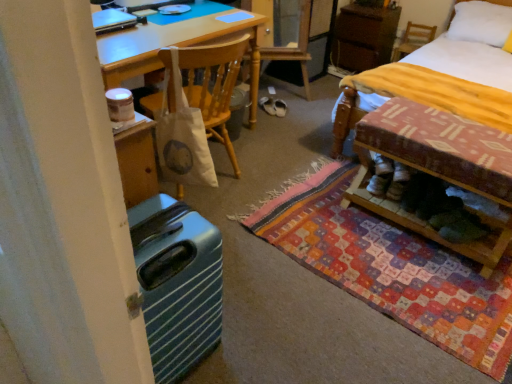
What do you see at coordinates (268, 105) in the screenshot? This screenshot has height=384, width=512. I see `white fabric shoe at center, marked as the first footwear in a left-to-right arrangement` at bounding box center [268, 105].

Where is `white soft pillow at upper right`? The width and height of the screenshot is (512, 384). white soft pillow at upper right is located at coordinates [481, 23].

Image resolution: width=512 pixels, height=384 pixels. Find the location of `multicolored woven mat at lower right`. multicolored woven mat at lower right is located at coordinates (390, 267).

Identify the location of yellow fabric bed at lower right. (345, 119).

Find the location of a particular element. wooden chair at upper right, positioned as the 2th chair in bottom-to-top order is located at coordinates (413, 39).

Which object is closer to the camera, wooden chair at upper right, the 2th chair from the left, or white canvas bag at center, acting as the 1th chair starting from the front?

white canvas bag at center, acting as the 1th chair starting from the front, is in front.

Is wooden chair at upper right, placed as the first chair when sorted from back to front, oriented away from white canvas bag at center, the 2th chair positioned from the back?

wooden chair at upper right, placed as the first chair when sorted from back to front, is not turned away from white canvas bag at center, the 2th chair positioned from the back.

From the image's perspective, is wooden chair at upper right, positioned as the 2th chair in bottom-to-top order, located beneath white canvas bag at center, acting as the 1th chair starting from the front?

No, from the image's perspective, wooden chair at upper right, positioned as the 2th chair in bottom-to-top order, is not below white canvas bag at center, acting as the 1th chair starting from the front.

Based on the photo, from the image's perspective, which is above, brown wood cabinet at upper right or white canvas bag at center, the second chair in the top-to-bottom sequence?

brown wood cabinet at upper right, from the image's perspective.

Can you confirm if brown wood cabinet at upper right is positioned to the left of white canvas bag at center, the 1th chair when ordered from bottom to top?

No, brown wood cabinet at upper right is not to the left of white canvas bag at center, the 1th chair when ordered from bottom to top.

Is brown wood cabinet at upper right smaller than white canvas bag at center, acting as the 1th chair starting from the front?

No.

Are white fabric shoe at center, the 2th footwear viewed from the left, and wooden chair at upper right, the 2th chair from the left, making contact?

They are not placed beside each other.

How many degrees apart are the facing directions of white fabric shoe at center, the first footwear viewed from the right, and wooden chair at upper right, placed as the first chair when sorted from back to front?

There is a 32.6-degree angle between the facing directions of white fabric shoe at center, the first footwear viewed from the right, and wooden chair at upper right, placed as the first chair when sorted from back to front.

Looking at this image, from a real-world perspective, is white fabric shoe at center, the first footwear viewed from the right, physically below wooden chair at upper right, placed as the first chair when sorted from back to front?

Yes, from a real-world perspective, white fabric shoe at center, the first footwear viewed from the right, is under wooden chair at upper right, placed as the first chair when sorted from back to front.

Measure the distance between white fabric shoe at center, the 2th footwear viewed from the left, and wooden chair at upper right, the 2th chair from the left.

The distance of white fabric shoe at center, the 2th footwear viewed from the left, from wooden chair at upper right, the 2th chair from the left, is 5.39 feet.

Considering the relative sizes of yellow fabric bed at lower right and brown wood cabinet at upper right in the image provided, is yellow fabric bed at lower right shorter than brown wood cabinet at upper right?

No, yellow fabric bed at lower right is not shorter than brown wood cabinet at upper right.

You are a GUI agent. You are given a task and a screenshot of the screen. Output one action in this format:
    pyautogui.click(x=<x>, y=<y>)
    Task: Click on the cabinetry behind the yellow fabric bed at lower right
    The height and width of the screenshot is (384, 512).
    Given the screenshot: What is the action you would take?
    pyautogui.click(x=364, y=37)

In the scene shown: Considering the positions of objects yellow fabric bed at lower right and brown wood cabinet at upper right in the image provided, who is more to the right, yellow fabric bed at lower right or brown wood cabinet at upper right?

From the viewer's perspective, yellow fabric bed at lower right appears more on the right side.

Considering the sizes of objects yellow fabric bed at lower right and brown wood cabinet at upper right in the image provided, who is smaller, yellow fabric bed at lower right or brown wood cabinet at upper right?

With smaller size is brown wood cabinet at upper right.

Who is smaller, brown wood cabinet at upper right or white soft pillow at upper right?

brown wood cabinet at upper right.

Considering the relative positions of brown wood cabinet at upper right and white soft pillow at upper right in the image provided, is brown wood cabinet at upper right to the left of white soft pillow at upper right from the viewer's perspective?

Yes.

From the image's perspective, is brown wood cabinet at upper right on white soft pillow at upper right?

Correct, brown wood cabinet at upper right appears higher than white soft pillow at upper right in the image.

Is brown wood cabinet at upper right closer to camera compared to white soft pillow at upper right?

No.

Is white fabric shoe at center, marked as the 2th footwear in a right-to-left arrangement, positioned with its back to wooden chair at upper right, the 1th chair viewed from the right?

No, white fabric shoe at center, marked as the 2th footwear in a right-to-left arrangement,'s orientation is not away from wooden chair at upper right, the 1th chair viewed from the right.

From a real-world perspective, is white fabric shoe at center, marked as the first footwear in a left-to-right arrangement, positioned over wooden chair at upper right, the 1th chair viewed from the right, based on gravity?

No, from a real-world perspective, white fabric shoe at center, marked as the first footwear in a left-to-right arrangement, is not on top of wooden chair at upper right, the 1th chair viewed from the right.

Does white fabric shoe at center, marked as the first footwear in a left-to-right arrangement, appear on the right side of wooden chair at upper right, which appears as the first chair when viewed from the top?

Incorrect, white fabric shoe at center, marked as the first footwear in a left-to-right arrangement, is not on the right side of wooden chair at upper right, which appears as the first chair when viewed from the top.

From the image's perspective, between white fabric shoe at center, marked as the 2th footwear in a right-to-left arrangement, and wooden chair at upper right, the 1th chair viewed from the right, which one is located above?

wooden chair at upper right, the 1th chair viewed from the right, is shown above in the image.

Is wooden chair at upper right, positioned as the second chair in front-to-back order, situated inside multicolored woven mat at lower right or outside?

wooden chair at upper right, positioned as the second chair in front-to-back order, lies outside multicolored woven mat at lower right.

Between wooden chair at upper right, positioned as the 2th chair in bottom-to-top order, and multicolored woven mat at lower right, which one appears on the left side from the viewer's perspective?

From the viewer's perspective, multicolored woven mat at lower right appears more on the left side.

How many degrees apart are the facing directions of wooden chair at upper right, which appears as the first chair when viewed from the top, and multicolored woven mat at lower right?

The angle between the facing direction of wooden chair at upper right, which appears as the first chair when viewed from the top, and the facing direction of multicolored woven mat at lower right is 10.6 degrees.

Looking at this image, is wooden chair at upper right, positioned as the 2th chair in bottom-to-top order, closer to camera compared to multicolored woven mat at lower right?

No, wooden chair at upper right, positioned as the 2th chair in bottom-to-top order, is further to the viewer.

In order to click on chair behind the white canvas bag at center, the second chair in the top-to-bottom sequence in this screenshot , I will do `click(413, 39)`.

Where is `cabinetry below the white canvas bag at center, which ranks as the second chair in right-to-left order (from a real-world perspective)`? cabinetry below the white canvas bag at center, which ranks as the second chair in right-to-left order (from a real-world perspective) is located at coordinates (364, 37).

Looking at this image, looking at the image, which one is located closer to wooden chair at upper right, positioned as the second chair in front-to-back order, white fabric shoe at center, marked as the 2th footwear in a right-to-left arrangement, or white fabric shoe at center, the first footwear viewed from the right?

Based on the image, white fabric shoe at center, the first footwear viewed from the right, appears to be nearer to wooden chair at upper right, positioned as the second chair in front-to-back order.

Which object lies further to the anchor point white fabric shoe at center, the 2th footwear viewed from the left, white fabric shoe at center, marked as the 2th footwear in a right-to-left arrangement, or brown wood cabinet at upper right?

The object further to white fabric shoe at center, the 2th footwear viewed from the left, is brown wood cabinet at upper right.

Estimate the real-world distances between objects in this image. Which object is closer to wooden bed frame at lower right, white fabric shoe at center, the first footwear viewed from the right, or white soft pillow at upper right?

Based on the image, white fabric shoe at center, the first footwear viewed from the right, appears to be nearer to wooden bed frame at lower right.

Looking at the image, which one is located closer to multicolored woven mat at lower right, white canvas bag at center, which ranks as the second chair in right-to-left order, or white soft pillow at upper right?

white canvas bag at center, which ranks as the second chair in right-to-left order, is closer to multicolored woven mat at lower right.

Based on their spatial positions, is brown wood cabinet at upper right or yellow fabric bed at lower right closer to wooden chair at upper right, positioned as the second chair in front-to-back order?

brown wood cabinet at upper right lies closer to wooden chair at upper right, positioned as the second chair in front-to-back order, than the other object.

Based on their spatial positions, is multicolored woven mat at lower right or white fabric shoe at center, marked as the first footwear in a left-to-right arrangement, further from white canvas bag at center, which ranks as the second chair in right-to-left order?

white fabric shoe at center, marked as the first footwear in a left-to-right arrangement.

Considering their positions, is white fabric shoe at center, the 2th footwear viewed from the left, positioned closer to multicolored woven mat at lower right than white canvas bag at center, the 1th chair when ordered from bottom to top?

Based on the image, white canvas bag at center, the 1th chair when ordered from bottom to top, appears to be nearer to multicolored woven mat at lower right.

Estimate the real-world distances between objects in this image. Which object is closer to white soft pillow at upper right, wooden bed frame at lower right or wooden chair at upper right, which appears as the first chair when viewed from the top?

wooden chair at upper right, which appears as the first chair when viewed from the top, lies closer to white soft pillow at upper right than the other object.

The height and width of the screenshot is (384, 512). Find the location of `footwear between wooden bed frame at lower right and white fabric shoe at center, the first footwear viewed from the right, from front to back`. footwear between wooden bed frame at lower right and white fabric shoe at center, the first footwear viewed from the right, from front to back is located at coordinates (268, 105).

Image resolution: width=512 pixels, height=384 pixels. Identify the location of footwear between white fabric shoe at center, marked as the first footwear in a left-to-right arrangement, and wooden chair at upper right, the 2th chair from the left. (279, 108).

At what (x,y) coordinates should I click in order to perform the action: click on cabinetry between white fabric shoe at center, the 2th footwear viewed from the left, and white soft pillow at upper right from left to right. Please return your answer as a coordinate pair (x, y). This screenshot has height=384, width=512. Looking at the image, I should click on (364, 37).

Locate an element on the screen. This screenshot has width=512, height=384. chair located between wooden bed frame at lower right and wooden chair at upper right, positioned as the second chair in front-to-back order, in the depth direction is located at coordinates (209, 84).